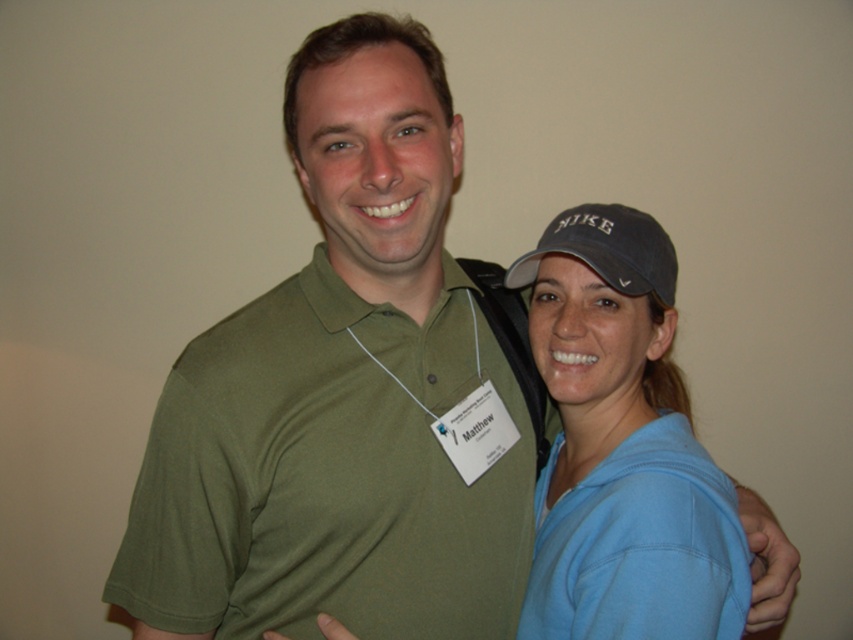
Does olive green jersey at center appear on the right side of dark gray fabric baseball cap at upper right?

No, olive green jersey at center is not to the right of dark gray fabric baseball cap at upper right.

Between olive green jersey at center and dark gray fabric baseball cap at upper right, which one has less height?

Standing shorter between the two is dark gray fabric baseball cap at upper right.

Describe the element at coordinates (328, 476) in the screenshot. I see `olive green jersey at center` at that location.

In order to click on olive green jersey at center in this screenshot , I will do `click(328, 476)`.

Which is above, blue cotton shirt at right or dark gray fabric baseball cap at upper right?

Positioned higher is dark gray fabric baseball cap at upper right.

Which is behind, point (641, 346) or point (645, 268)?

The point (641, 346) is more distant.

At what (x,y) coordinates should I click in order to perform the action: click on blue cotton shirt at right. Please return your answer as a coordinate pair (x, y). Looking at the image, I should click on (622, 448).

Who is more forward, (631, 612) or (538, 252)?

Point (631, 612)

Does blue cotton polo shirt at right have a lesser width compared to dark gray fabric baseball cap at upper right?

In fact, blue cotton polo shirt at right might be wider than dark gray fabric baseball cap at upper right.

This screenshot has height=640, width=853. In order to click on blue cotton polo shirt at right in this screenshot , I will do `click(639, 545)`.